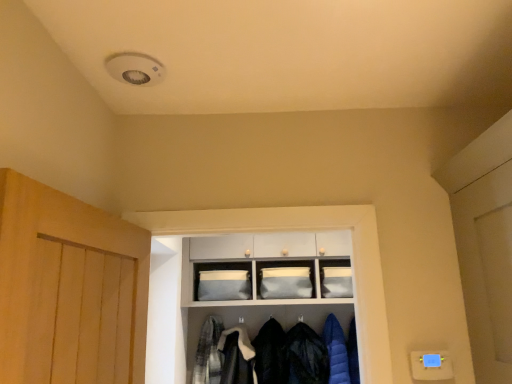
Question: Is point (323, 382) closer or farther from the camera than point (204, 350)?

Choices:
 (A) farther
 (B) closer

Answer: (B)

Question: In terms of size, does dark blue quilted jacket at center, the 4th clothing positioned from the left, appear bigger or smaller than plaid fabric shirt at center, which is counted as the 5th clothing, starting from the right?

Choices:
 (A) small
 (B) big

Answer: (B)

Question: Estimate the real-world distances between objects in this image. Which object is closer to the dark blue quilted jacket at center, the 4th clothing positioned from the left?

Choices:
 (A) satin fabric cabinet at center
 (B) blue quilted jacket at lower right, positioned as the 1th clothing in right-to-left order
 (C) matte gray fabric cabinet at upper center
 (D) plaid fabric shirt at center, the 1th clothing viewed from the left
 (E) velvet black coat at center, which is counted as the third clothing, starting from the left

Answer: (B)

Question: Estimate the real-world distances between objects in this image. Which object is farther from the matte gray fabric cabinet at upper center?

Choices:
 (A) white fluffy coat at lower center, which is the 4th clothing from right to left
 (B) blue quilted jacket at lower right, positioned as the 1th clothing in right-to-left order
 (C) dark blue quilted jacket at center, the second clothing in the right-to-left sequence
 (D) velvet black coat at center, placed as the third clothing when sorted from right to left
 (E) satin fabric cabinet at center

Answer: (A)